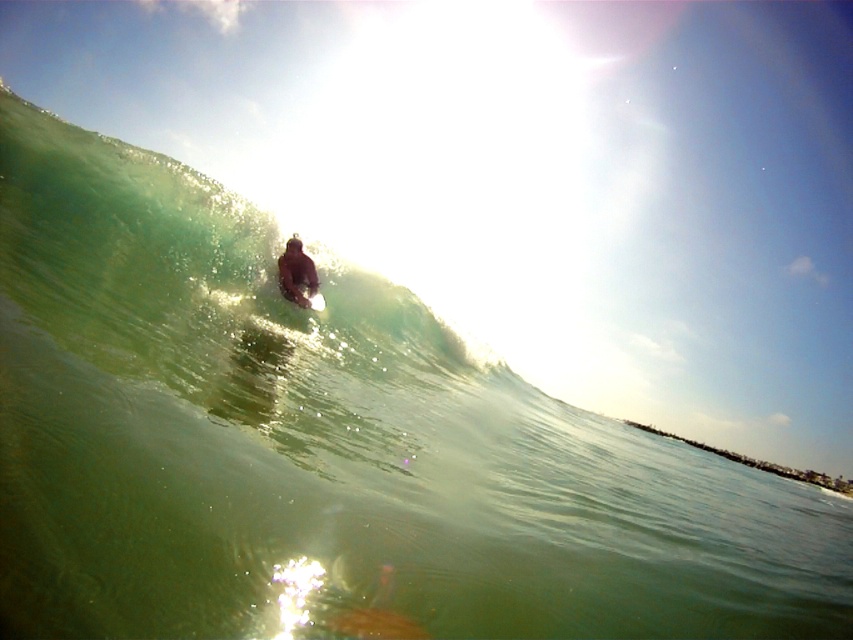
Question: Which point is closer to the camera?

Choices:
 (A) white foam surfboard at center
 (B) smooth white surfboard at center
 (C) brown wetsuit at center

Answer: (C)

Question: From the image, what is the correct spatial relationship of brown wetsuit at center in relation to smooth white surfboard at center?

Choices:
 (A) above
 (B) below

Answer: (A)

Question: Which point is farther to the camera?

Choices:
 (A) smooth white surfboard at center
 (B) white foam surfboard at center
 (C) brown wetsuit at center

Answer: (A)

Question: Does brown wetsuit at center have a lesser width compared to white foam surfboard at center?

Choices:
 (A) no
 (B) yes

Answer: (A)

Question: Among these points, which one is farthest from the camera?

Choices:
 (A) (315, 300)
 (B) (291, 282)

Answer: (A)

Question: Does brown wetsuit at center have a lesser width compared to white foam surfboard at center?

Choices:
 (A) yes
 (B) no

Answer: (B)